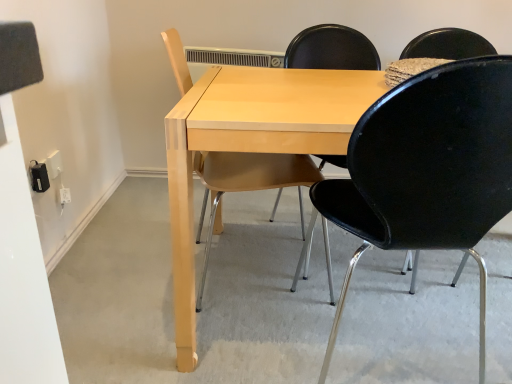
Question: Can you confirm if light wood table at center is thinner than black plastic chair at center, which is counted as the first chair, starting from the right?

Choices:
 (A) yes
 (B) no

Answer: (B)

Question: Could you tell me if light wood table at center is facing black plastic chair at center, which is counted as the first chair, starting from the right?

Choices:
 (A) yes
 (B) no

Answer: (A)

Question: Is light wood table at center smaller than black plastic chair at center, which is counted as the first chair, starting from the right?

Choices:
 (A) no
 (B) yes

Answer: (A)

Question: Is light wood table at center further to camera compared to black plastic chair at center, which is counted as the first chair, starting from the right?

Choices:
 (A) no
 (B) yes

Answer: (B)

Question: From the image's perspective, is light wood table at center on black plastic chair at center, which is counted as the first chair, starting from the right?

Choices:
 (A) yes
 (B) no

Answer: (A)

Question: Does light wood table at center have a greater height compared to black plastic chair at center, positioned as the 2th chair in left-to-right order?

Choices:
 (A) yes
 (B) no

Answer: (B)

Question: From a real-world perspective, does light wood table at center sit lower than light wood chair at center, the 2th chair positioned from the right?

Choices:
 (A) no
 (B) yes

Answer: (B)

Question: From a real-world perspective, is light wood table at center physically above light wood chair at center, the 2th chair positioned from the right?

Choices:
 (A) no
 (B) yes

Answer: (A)

Question: Is light wood table at center facing away from light wood chair at center, which appears as the 1th chair when viewed from the left?

Choices:
 (A) yes
 (B) no

Answer: (B)

Question: Considering the relative sizes of light wood table at center and light wood chair at center, the 2th chair positioned from the right, in the image provided, is light wood table at center taller than light wood chair at center, the 2th chair positioned from the right,?

Choices:
 (A) no
 (B) yes

Answer: (A)

Question: Considering the relative positions of light wood table at center and light wood chair at center, which appears as the 1th chair when viewed from the left, in the image provided, is light wood table at center to the left of light wood chair at center, which appears as the 1th chair when viewed from the left, from the viewer's perspective?

Choices:
 (A) yes
 (B) no

Answer: (B)

Question: Does light wood table at center turn towards light wood chair at center, the 2th chair positioned from the right?

Choices:
 (A) yes
 (B) no

Answer: (B)

Question: Is black plastic chair at center, which is counted as the first chair, starting from the right, aimed at light wood chair at center, which appears as the 1th chair when viewed from the left?

Choices:
 (A) yes
 (B) no

Answer: (B)